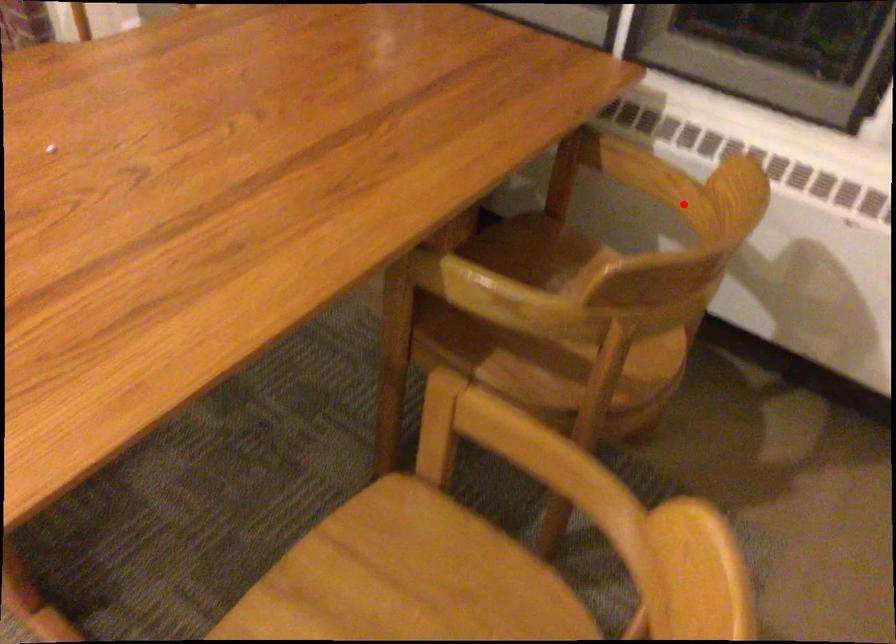
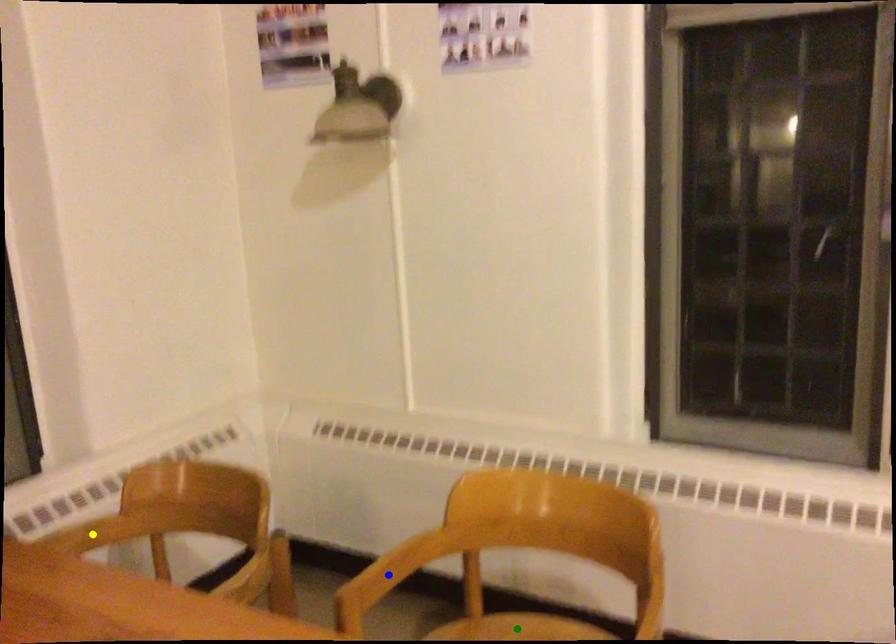
Question: I am providing you with two images of the same scene from different viewpoints. A red point is marked on the first image. You are given multiple points on the second image. In image 2, which mark is for the same physical point as the one in image 1?

Choices:
 (A) yellow point
 (B) green point
 (C) blue point

Answer: (A)